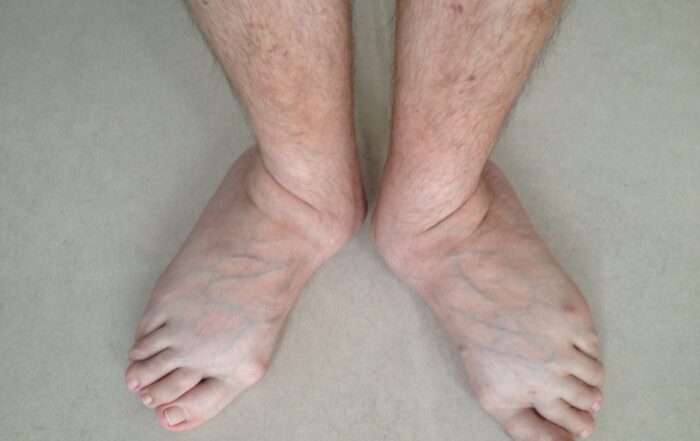
Where is `floor`? The height and width of the screenshot is (441, 700). floor is located at coordinates (383, 350), (162, 224), (624, 152).